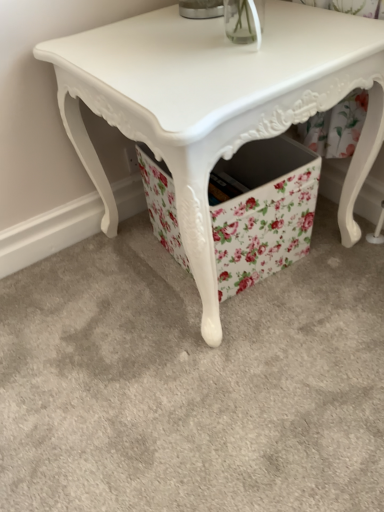
The width and height of the screenshot is (384, 512). I want to click on vacant area situated to the left side of white glossy table at center, so click(x=71, y=310).